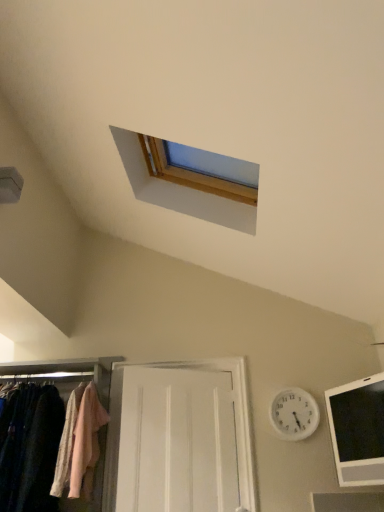
Describe the element at coordinates (64, 373) in the screenshot. I see `matte fabric closet at lower left` at that location.

Where is `white wooden door at center`? The width and height of the screenshot is (384, 512). white wooden door at center is located at coordinates (172, 441).

Considering the positions of point (132, 494) and point (299, 397), is point (132, 494) closer or farther from the camera than point (299, 397)?

Clearly, point (132, 494) is closer to the camera than point (299, 397).

Locate an element on the screen. door that appears in front of the white plastic clock at upper center is located at coordinates (172, 441).

Would you say white wooden door at center is a long distance from white plastic clock at upper center?

That's not correct — white wooden door at center is a little close to white plastic clock at upper center.

Considering the relative positions of white wooden door at center and white plastic clock at upper center in the image provided, is white wooden door at center in front of white plastic clock at upper center?

Yes, the depth of white wooden door at center is less than that of white plastic clock at upper center.

Which object is further away from the camera, white plastic clock at upper center or light pink fabric at left?

white plastic clock at upper center is further away from the camera.

What's the angular difference between white plastic clock at upper center and light pink fabric at left's facing directions?

The angle between the facing direction of white plastic clock at upper center and the facing direction of light pink fabric at left is 3.67 degrees.

In the scene shown: From the image's perspective, is white plastic clock at upper center over light pink fabric at left?

Yes.

Is black glossy tablet at lower right closer to the viewer compared to light pink fabric at left?

That is True.

From the image's perspective, does black glossy tablet at lower right appear lower than light pink fabric at left?

No, from the image's perspective, black glossy tablet at lower right is not beneath light pink fabric at left.

Based on the photo, is black glossy tablet at lower right wider than light pink fabric at left?

No.

From the picture: Can we say black glossy tablet at lower right lies outside light pink fabric at left?

Absolutely, black glossy tablet at lower right is external to light pink fabric at left.

From a real-world perspective, is white plastic clock at upper center positioned over black glossy tablet at lower right based on gravity?

Correct, in the physical world, white plastic clock at upper center is higher than black glossy tablet at lower right.

Considering the sizes of objects white plastic clock at upper center and black glossy tablet at lower right in the image provided, who is wider, white plastic clock at upper center or black glossy tablet at lower right?

With larger width is black glossy tablet at lower right.

Identify the location of hole on the right side of white plastic clock at upper center. (358, 430).

Does point (383, 483) come farther from viewer compared to point (279, 432)?

No, (383, 483) is closer to viewer.

Locate an element on the screen. clock located above the black glossy tablet at lower right (from a real-world perspective) is located at coordinates (294, 414).

Considering the relative sizes of black glossy tablet at lower right and white plastic clock at upper center in the image provided, is black glossy tablet at lower right wider than white plastic clock at upper center?

Indeed, black glossy tablet at lower right has a greater width compared to white plastic clock at upper center.

From the image's perspective, who appears lower, black glossy tablet at lower right or white plastic clock at upper center?

white plastic clock at upper center.

Considering the relative sizes of white wooden door at center and matte fabric closet at lower left in the image provided, is white wooden door at center bigger than matte fabric closet at lower left?

Incorrect, white wooden door at center is not larger than matte fabric closet at lower left.

In terms of height, does white wooden door at center look taller or shorter compared to matte fabric closet at lower left?

Considering their sizes, white wooden door at center has more height than matte fabric closet at lower left.

Looking at their sizes, would you say white wooden door at center is wider or thinner than matte fabric closet at lower left?

white wooden door at center is thinner than matte fabric closet at lower left.

From a real-world perspective, between white wooden door at center and matte fabric closet at lower left, who is vertically lower?

matte fabric closet at lower left.

Does matte fabric closet at lower left lie behind light pink fabric at left?

No.

Can you tell me how much matte fabric closet at lower left and light pink fabric at left differ in facing direction?

There is a 0.246-degree angle between the facing directions of matte fabric closet at lower left and light pink fabric at left.

Is matte fabric closet at lower left wider or thinner than light pink fabric at left?

matte fabric closet at lower left is wider than light pink fabric at left.

Who is smaller, matte fabric closet at lower left or light pink fabric at left?

Smaller between the two is light pink fabric at left.

Where is `door located below the white plastic clock at upper center (from the image's perspective)`? door located below the white plastic clock at upper center (from the image's perspective) is located at coordinates (172, 441).

Where is `clock located above the light pink fabric at left (from a real-world perspective)`? clock located above the light pink fabric at left (from a real-world perspective) is located at coordinates (294, 414).

Considering their positions, is white plastic clock at upper center positioned closer to black glossy tablet at lower right than matte fabric closet at lower left?

white plastic clock at upper center lies closer to black glossy tablet at lower right than the other object.

Looking at the image, which one is located further to black glossy tablet at lower right, light pink fabric at left or white wooden door at center?

light pink fabric at left lies further to black glossy tablet at lower right than the other object.

Estimate the real-world distances between objects in this image. Which object is further from matte fabric closet at lower left, white plastic clock at upper center or black glossy tablet at lower right?

black glossy tablet at lower right is positioned further to the anchor matte fabric closet at lower left.

Considering their positions, is white wooden door at center positioned further to black glossy tablet at lower right than white plastic clock at upper center?

white wooden door at center is further to black glossy tablet at lower right.

Estimate the real-world distances between objects in this image. Which object is further from white wooden door at center, white plastic clock at upper center or matte fabric closet at lower left?

white plastic clock at upper center is positioned further to the anchor white wooden door at center.

Which object lies further to the anchor point white wooden door at center, matte fabric closet at lower left or black glossy tablet at lower right?

black glossy tablet at lower right is further to white wooden door at center.

Based on their spatial positions, is matte fabric closet at lower left or light pink fabric at left closer to black glossy tablet at lower right?

light pink fabric at left is positioned closer to the anchor black glossy tablet at lower right.

Which object lies further to the anchor point matte fabric closet at lower left, white plastic clock at upper center or light pink fabric at left?

white plastic clock at upper center is further to matte fabric closet at lower left.

Identify the location of door between light pink fabric at left and black glossy tablet at lower right from left to right. Image resolution: width=384 pixels, height=512 pixels. (172, 441).

The image size is (384, 512). I want to click on door situated between matte fabric closet at lower left and white plastic clock at upper center from left to right, so click(x=172, y=441).

Locate an element on the screen. clock between white wooden door at center and black glossy tablet at lower right is located at coordinates (294, 414).

Where is `clothing between matte fabric closet at lower left and white wooden door at center from left to right`? clothing between matte fabric closet at lower left and white wooden door at center from left to right is located at coordinates (79, 444).